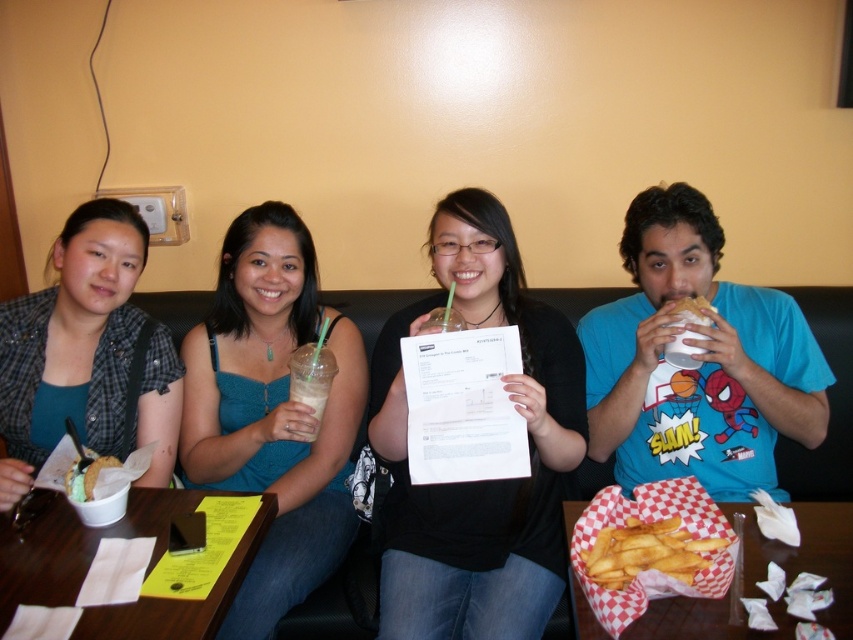
Does matte plaid shirt at left lie in front of checkered paper tray of fries at lower right?

No, it is behind checkered paper tray of fries at lower right.

Who is more distant from viewer, (77, 396) or (650, 600)?

Point (77, 396)

Locate an element on the screen. The width and height of the screenshot is (853, 640). matte plaid shirt at left is located at coordinates (71, 342).

Does golden crispy fries at lower center have a lesser width compared to green frosted cookie at lower left?

No.

Who is positioned more to the left, golden crispy fries at lower center or green frosted cookie at lower left?

green frosted cookie at lower left

Identify the location of golden crispy fries at lower center. This screenshot has width=853, height=640. pyautogui.click(x=647, y=552).

This screenshot has height=640, width=853. In order to click on golden crispy fries at lower center in this screenshot , I will do `click(647, 552)`.

Is teal fabric dress at center smaller than golden crispy fries at lower center?

Incorrect, teal fabric dress at center is not smaller in size than golden crispy fries at lower center.

Can you confirm if teal fabric dress at center is positioned above golden crispy fries at lower center?

Indeed, teal fabric dress at center is positioned over golden crispy fries at lower center.

Identify the location of teal fabric dress at center. [x=271, y=412].

Where is `teal fabric dress at center`? teal fabric dress at center is located at coordinates (271, 412).